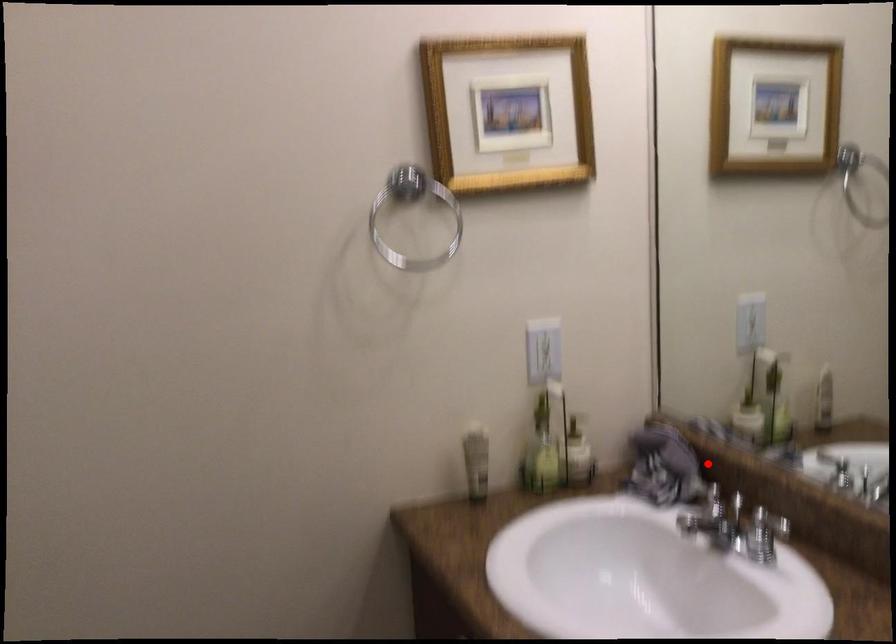
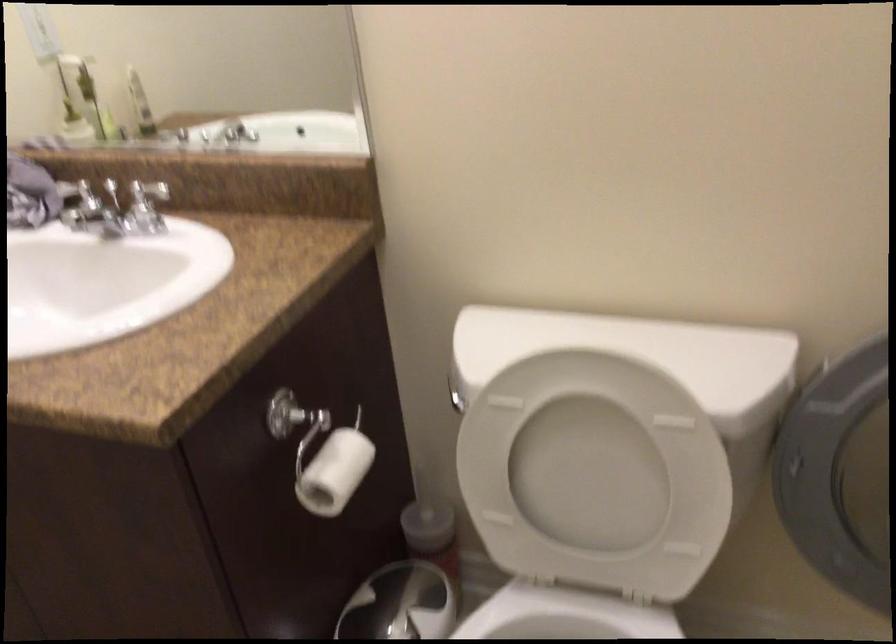
In the second image, find the point that corresponds to the highlighted location in the first image.

(64, 180)